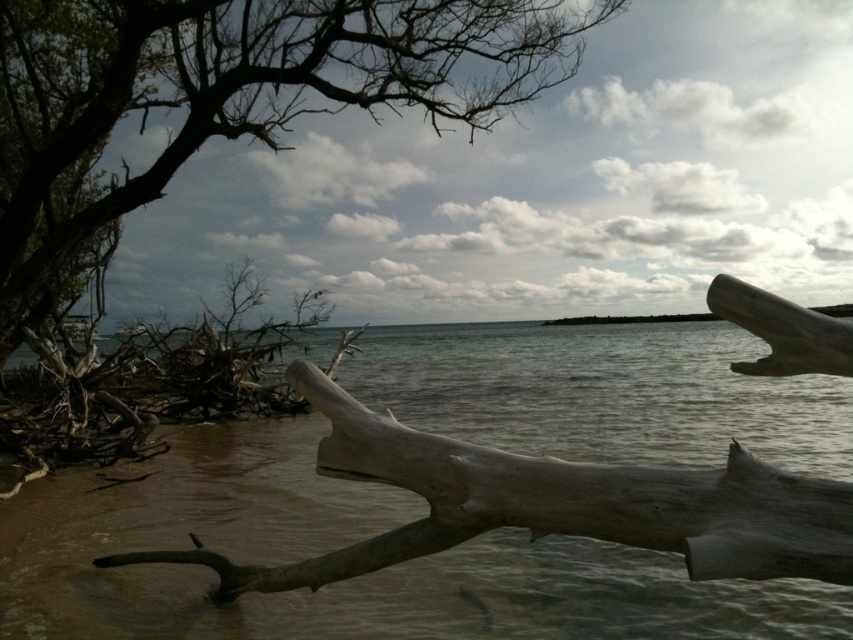
Who is more forward, (x=193, y=506) or (x=51, y=224)?

Positioned in front is point (x=193, y=506).

Between clear water at center and dark brown bark tree at upper left, which one appears on the left side from the viewer's perspective?

Positioned to the left is dark brown bark tree at upper left.

Who is more distant from viewer, [747,636] or [480,97]?

Point [480,97]

Identify the location of clear water at center. Image resolution: width=853 pixels, height=640 pixels. (352, 579).